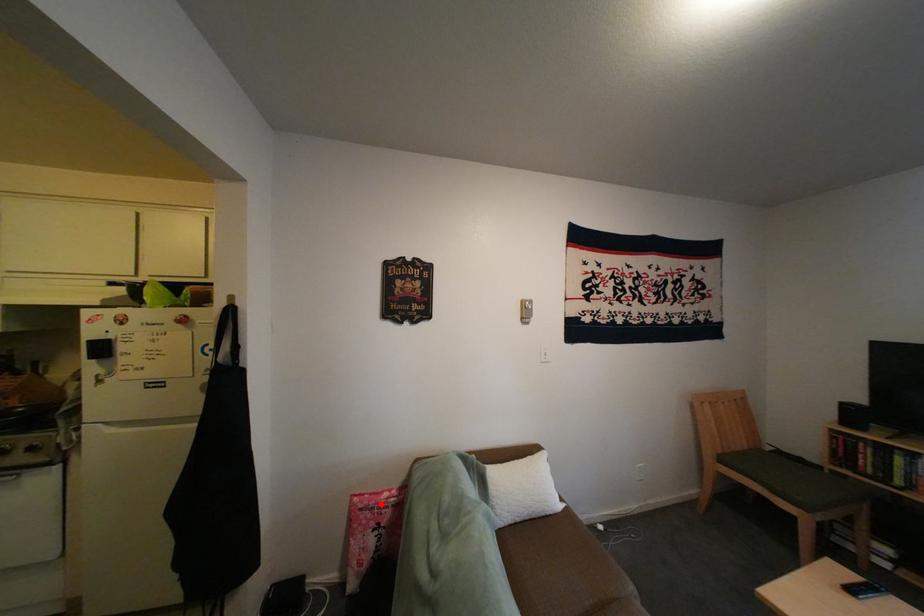
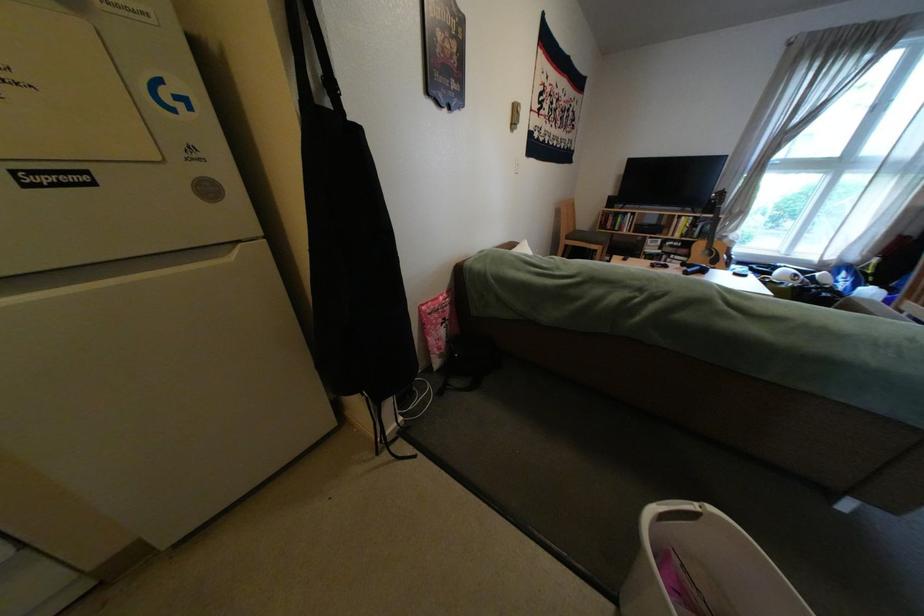
Question: I am providing you with two images of the same scene from different viewpoints. Given a red point in image1, look at the same physical point in image2. Is it:

Choices:
 (A) Closer to the viewpoint
 (B) Farther from the viewpoint

Answer: (A)